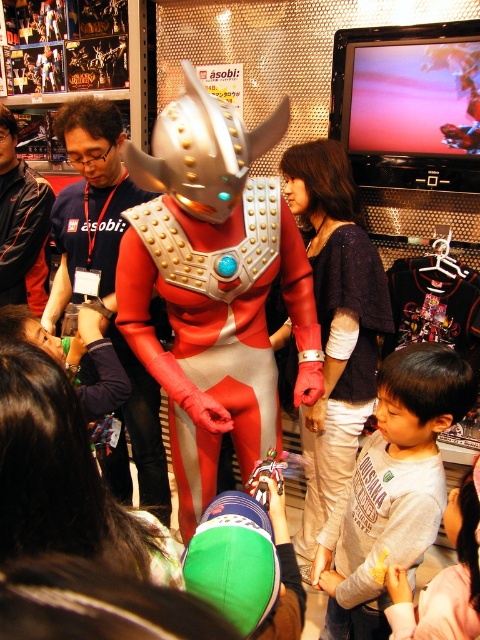
Is gray cotton shirt at lower right above metallic silver armor at center?

No.

Measure the distance between gray cotton shirt at lower right and camera.

gray cotton shirt at lower right and camera are 4.10 feet apart.

You are a GUI agent. You are given a task and a screenshot of the screen. Output one action in this format:
    pyautogui.click(x=<x>, y=<y>)
    Task: Click on the gray cotton shirt at lower right
    The height and width of the screenshot is (640, 480).
    Given the screenshot: What is the action you would take?
    pyautogui.click(x=392, y=488)

Can you confirm if shiny metallic suit at center is positioned below matte red costume at center?

Incorrect, shiny metallic suit at center is not positioned below matte red costume at center.

The height and width of the screenshot is (640, 480). Describe the element at coordinates (214, 285) in the screenshot. I see `shiny metallic suit at center` at that location.

Is point (283, 244) more distant than point (134, 426)?

No.

Find the location of a particular element. Image resolution: width=480 pixels, height=640 pixels. shiny metallic suit at center is located at coordinates (214, 285).

Which is more to the left, shiny metallic suit at center or dark blue fabric shirt at center?

dark blue fabric shirt at center

Locate an element on the screen. The image size is (480, 640). shiny metallic suit at center is located at coordinates (214, 285).